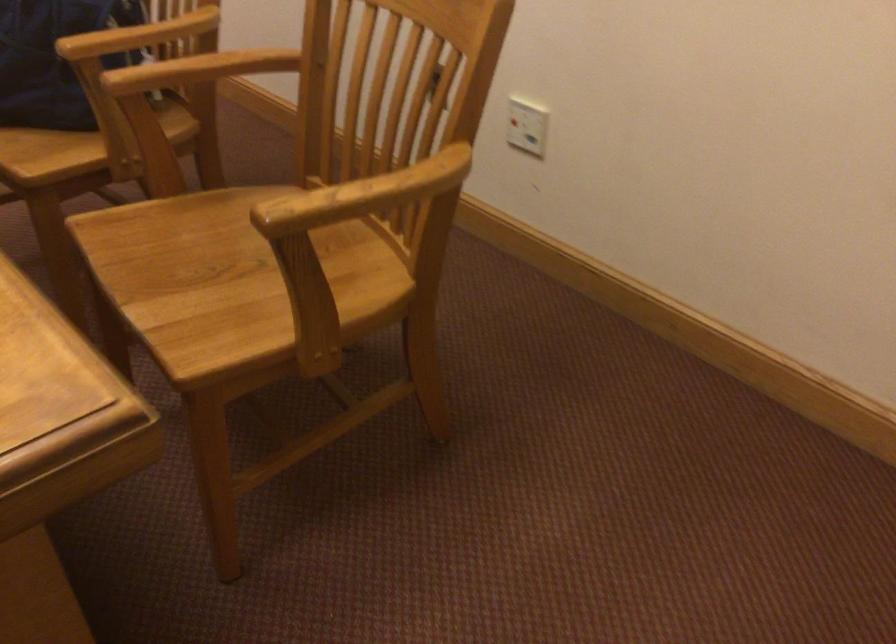
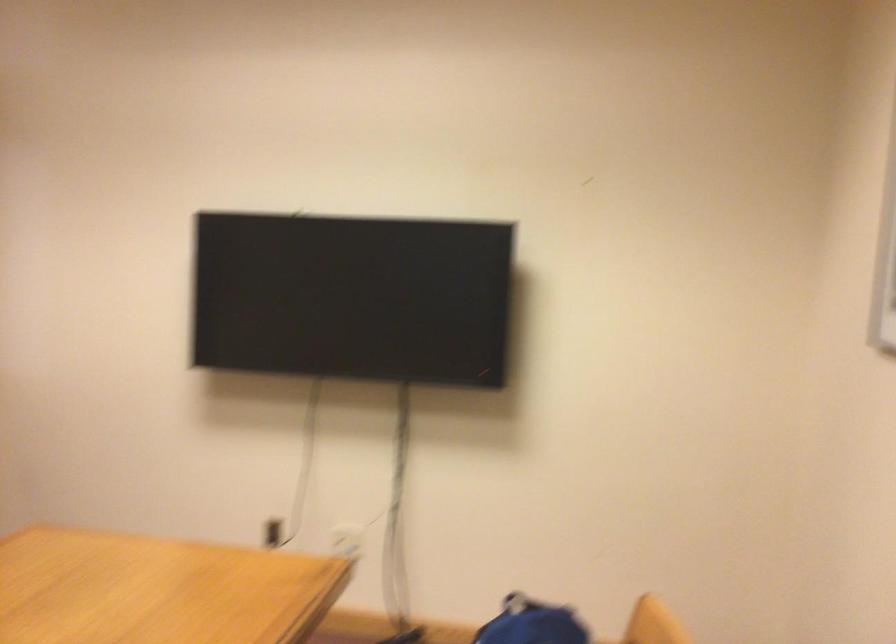
First-person continuous shooting, in which direction is the camera rotating?

The camera rotated toward left-up.